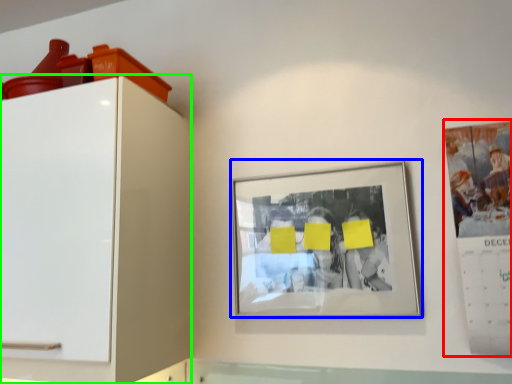
Question: Estimate the real-world distances between objects in this image. Which object is closer to poster (highlighted by a red box), picture frame (highlighted by a blue box) or furniture (highlighted by a green box)?

Choices:
 (A) picture frame
 (B) furniture

Answer: (A)